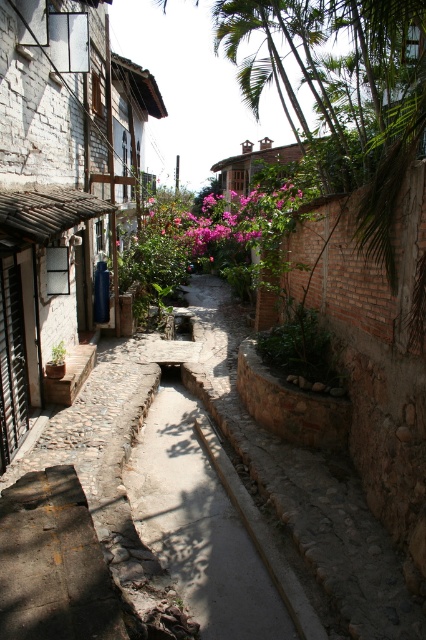
Question: Is pink matte flowers at center smaller than green leafy plant at center?

Choices:
 (A) yes
 (B) no

Answer: (B)

Question: Which point appears closest to the camera in this image?

Choices:
 (A) (210, 246)
 (B) (54, 364)

Answer: (B)

Question: Which point is closer to the camera?

Choices:
 (A) (x=63, y=346)
 (B) (x=279, y=220)

Answer: (A)

Question: Considering the relative positions of pink matte flowers at center and green leafy plant at center in the image provided, where is pink matte flowers at center located with respect to green leafy plant at center?

Choices:
 (A) below
 (B) above

Answer: (B)

Question: Can you confirm if pink matte flowers at center is positioned to the left of green leafy plant at center?

Choices:
 (A) no
 (B) yes

Answer: (A)